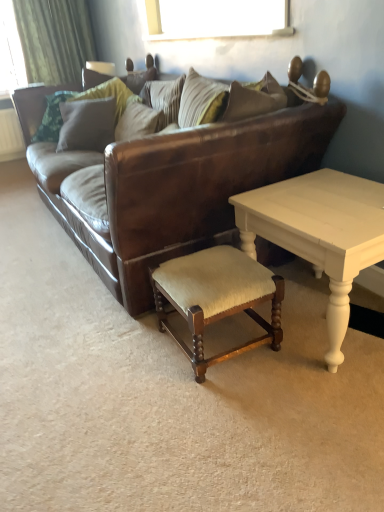
Question: Would you say brown leather couch at center is part of green fabric curtain at upper left's contents?

Choices:
 (A) yes
 (B) no

Answer: (B)

Question: Could you tell me if green fabric curtain at upper left is facing brown leather couch at center?

Choices:
 (A) no
 (B) yes

Answer: (B)

Question: From a real-world perspective, is green fabric curtain at upper left on brown leather couch at center?

Choices:
 (A) no
 (B) yes

Answer: (B)

Question: Is green fabric curtain at upper left completely or partially outside of brown leather couch at center?

Choices:
 (A) no
 (B) yes

Answer: (B)

Question: Can you confirm if green fabric curtain at upper left is shorter than brown leather couch at center?

Choices:
 (A) no
 (B) yes

Answer: (B)

Question: From a real-world perspective, is wooden upholstered stool at lower center physically located above or below brown leather couch at center?

Choices:
 (A) above
 (B) below

Answer: (B)

Question: In terms of height, does wooden upholstered stool at lower center look taller or shorter compared to brown leather couch at center?

Choices:
 (A) tall
 (B) short

Answer: (B)

Question: Is wooden upholstered stool at lower center wider or thinner than brown leather couch at center?

Choices:
 (A) thin
 (B) wide

Answer: (A)

Question: Do you think wooden upholstered stool at lower center is within brown leather couch at center, or outside of it?

Choices:
 (A) inside
 (B) outside

Answer: (B)

Question: From the image's perspective, is green fabric curtain at upper left above or below wooden upholstered stool at lower center?

Choices:
 (A) below
 (B) above

Answer: (B)

Question: From their relative heights in the image, would you say green fabric curtain at upper left is taller or shorter than wooden upholstered stool at lower center?

Choices:
 (A) tall
 (B) short

Answer: (A)

Question: In terms of width, does green fabric curtain at upper left look wider or thinner when compared to wooden upholstered stool at lower center?

Choices:
 (A) wide
 (B) thin

Answer: (B)

Question: From a real-world perspective, is green fabric curtain at upper left above or below wooden upholstered stool at lower center?

Choices:
 (A) below
 (B) above

Answer: (B)

Question: Considering the positions of brown leather couch at center and striped fabric pillow at center, the 2th pillow positioned from the left, in the image, is brown leather couch at center bigger or smaller than striped fabric pillow at center, the 2th pillow positioned from the left,?

Choices:
 (A) small
 (B) big

Answer: (B)

Question: Considering their positions, is brown leather couch at center located in front of or behind striped fabric pillow at center, the 2th pillow positioned from the left?

Choices:
 (A) behind
 (B) front

Answer: (B)